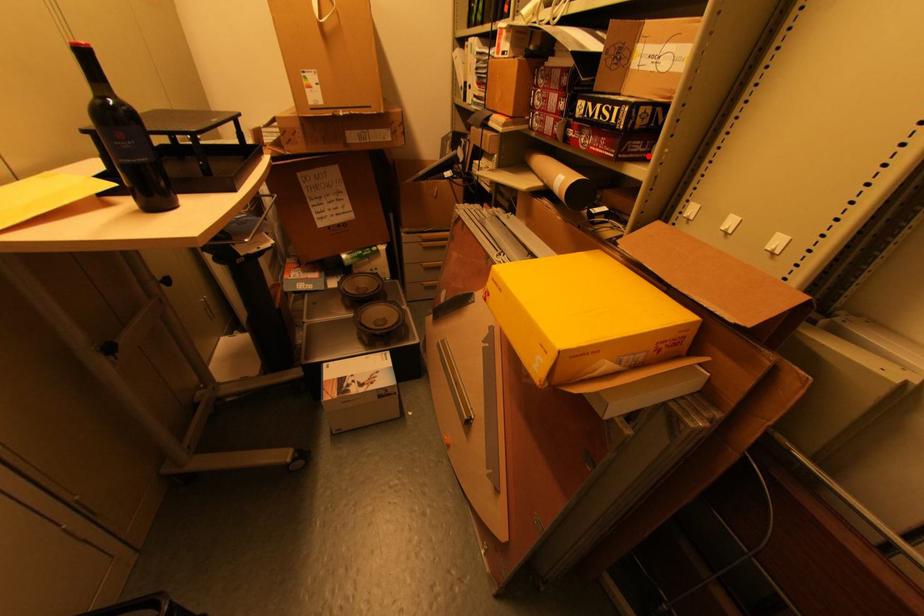
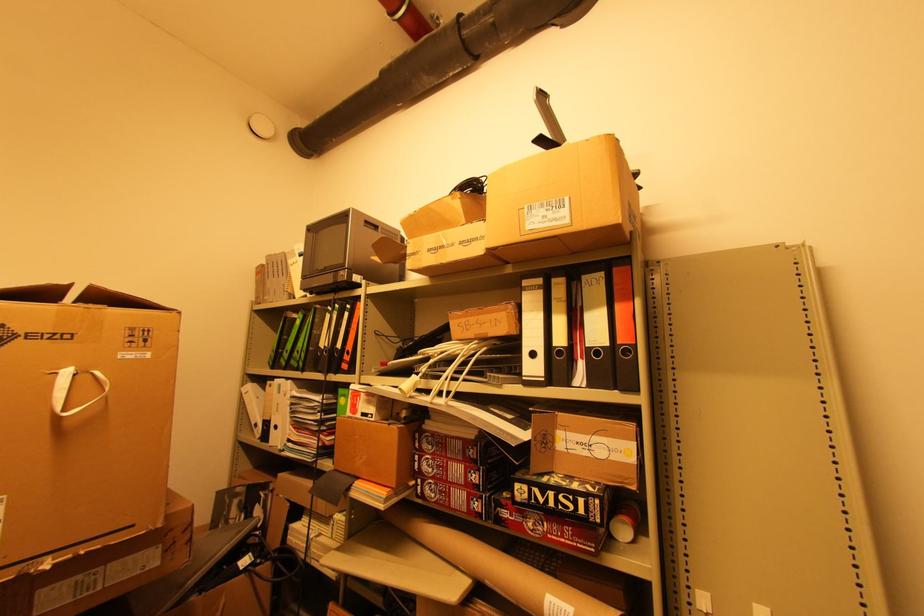
Find the pixel in the second image that matches the highlighted location in the first image.

(611, 535)